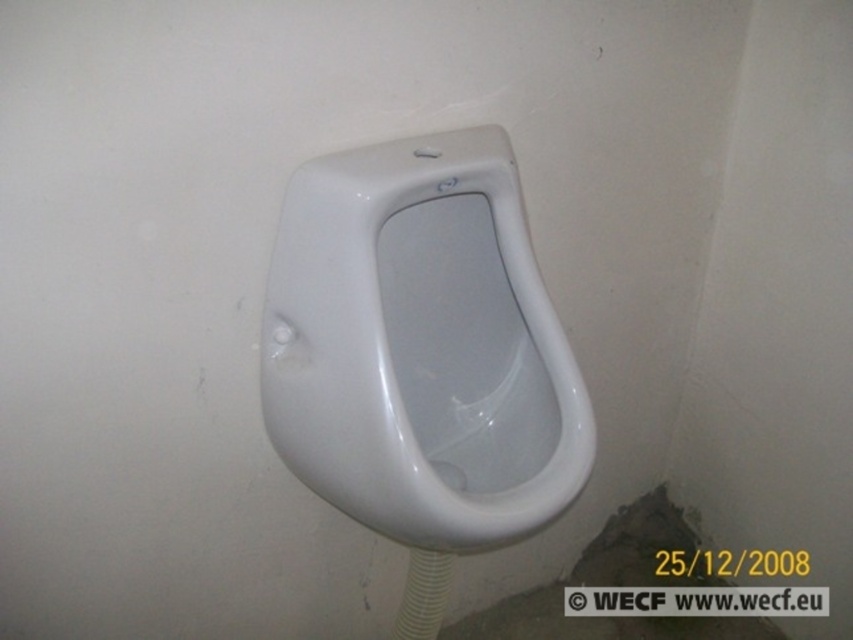
You are a plumber inspecting a bathroom and need to replace the white rubber pipe at lower center. The new pipe requires a minimum of 15 inches of clearance from the white glossy urinal at center for proper installation. Based on the image, is the current distance sufficient?

The white glossy urinal at center is 13.24 inches away from the white rubber pipe at lower center, which is less than the required 15 inches clearance. Therefore, the current distance is insufficient for proper installation.

You are standing in a restroom and need to determine if you can reach the point at coordinates point (291,456) without moving your feet. Your outstretched hand can reach up to 2.8 feet from your body. Can you reach that point?

The point (291,456) is 3.43 feet away from you, which is farther than your maximum reach of 2.8 feet. Therefore, you cannot reach the point without moving your feet.

You are a plumber inspecting the bathroom facilities. You need to locate the white rubber pipe at lower center. Based on the scene, where should you look relative to the white glossy urinal at center?

The white glossy urinal at center is to the left of the white rubber pipe at lower center, so the white rubber pipe at lower center is to the right of the white glossy urinal at center.